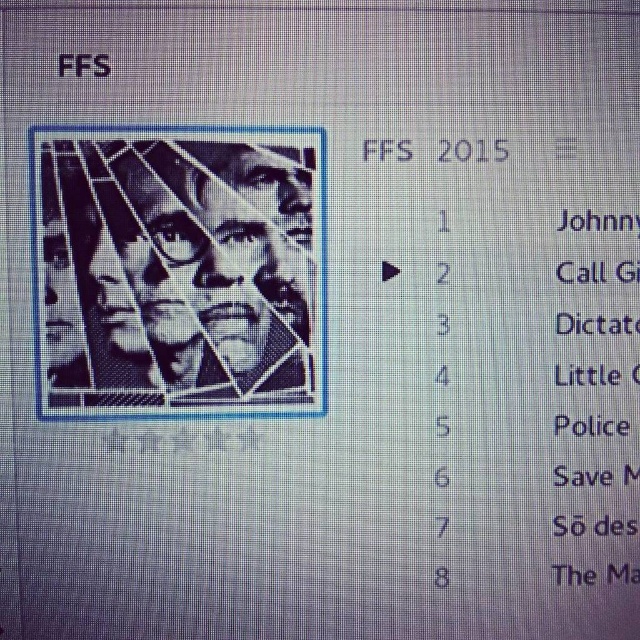
Question: Does black matte face at center appear on the left side of black pixelated text at upper left?

Choices:
 (A) yes
 (B) no

Answer: (B)

Question: Can you confirm if black matte face at center is smaller than black pixelated text at upper left?

Choices:
 (A) yes
 (B) no

Answer: (B)

Question: Among these points, which one is nearest to the camera?

Choices:
 (A) click(x=93, y=284)
 (B) click(x=93, y=56)

Answer: (B)

Question: Can you confirm if black matte face at center is wider than black pixelated text at upper left?

Choices:
 (A) yes
 (B) no

Answer: (A)

Question: Among these objects, which one is farthest from the camera?

Choices:
 (A) black matte face at center
 (B) black pixelated text at upper left

Answer: (A)

Question: Among these points, which one is nearest to the camera?

Choices:
 (A) (61, 54)
 (B) (145, 317)

Answer: (A)